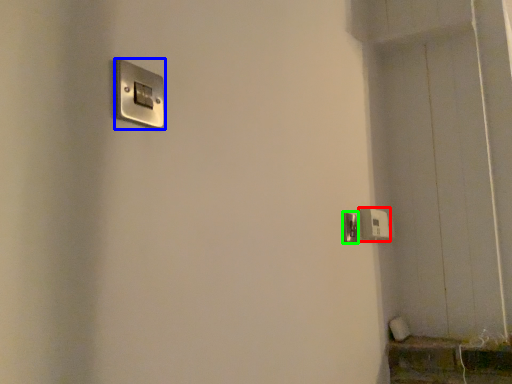
Question: Which is farther away from light switch (highlighted by a red box)? light switch (highlighted by a blue box) or door handle (highlighted by a green box)?

Choices:
 (A) light switch
 (B) door handle

Answer: (A)